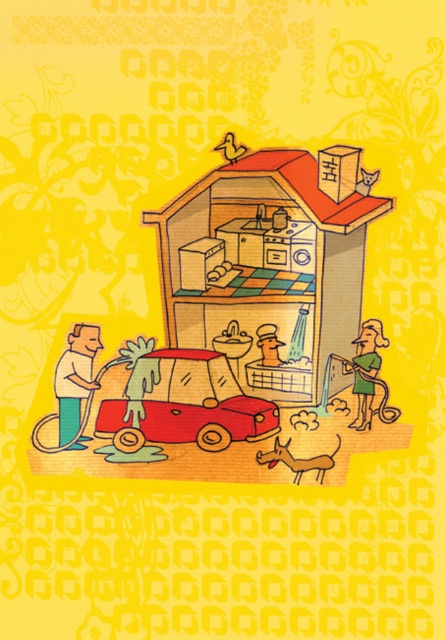
Question: Does rubber car at center appear on the right side of brown furry dog at lower center?

Choices:
 (A) no
 (B) yes

Answer: (A)

Question: Which of these objects is positioned closest to the green rubber hose at lower right?

Choices:
 (A) yellow rubber duck at upper center
 (B) brown furry dog at lower center

Answer: (B)

Question: Which object is the farthest from the yellow paper man at left?

Choices:
 (A) rubber car at center
 (B) green rubber hose at lower right

Answer: (B)

Question: Does shiny red car at lower center have a lesser width compared to yellow rubber duck at upper center?

Choices:
 (A) yes
 (B) no

Answer: (B)

Question: Among these points, which one is farthest from the camera?

Choices:
 (A) (232, 390)
 (B) (308, 355)
 (C) (368, 332)
 (D) (316, 456)

Answer: (A)

Question: In this image, where is green rubber hose at lower right located relative to brown furry dog at lower center?

Choices:
 (A) above
 (B) below

Answer: (A)